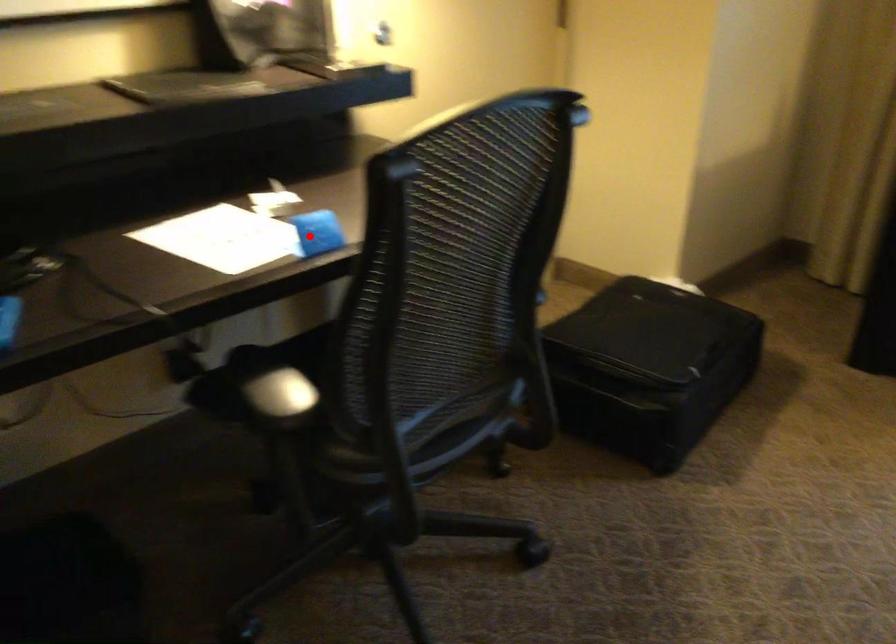
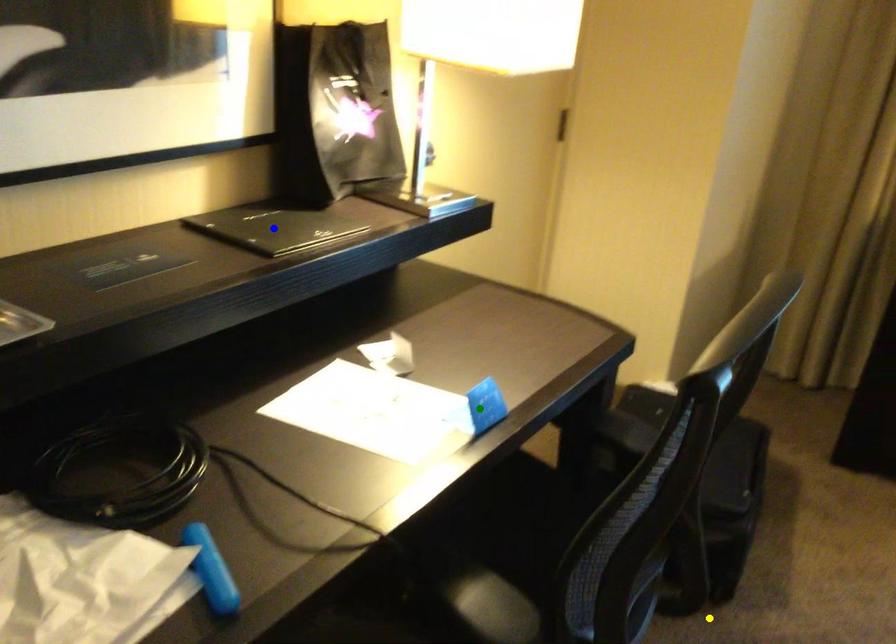
Question: I am providing you with two images of the same scene from different viewpoints. A red point is marked on the first image. You are given multiple points on the second image. Which spot in image 2 lines up with the point in image 1?

Choices:
 (A) green point
 (B) yellow point
 (C) blue point

Answer: (A)